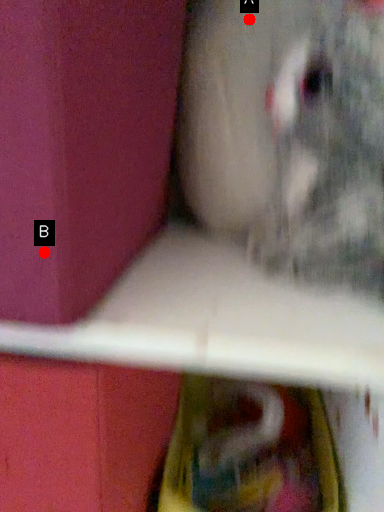
Question: Two points are circled on the image, labeled by A and B beside each circle. Which of the following is the closest to the observer?

Choices:
 (A) A is closer
 (B) B is closer

Answer: (B)